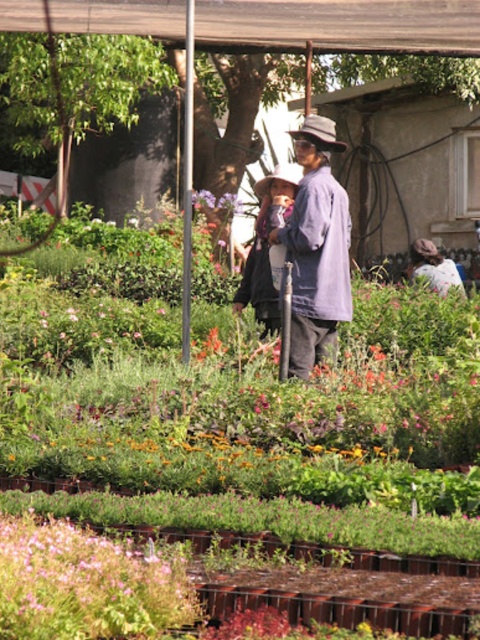
You are a gardener who needs to place a 3.5 feet wide decorative stone between the matte black jacket at center and the matte gray fedora at center. Is there enough space for the stone?

The distance between the matte black jacket at center and the matte gray fedora at center is 5.19 feet. Since the stone is 3.5 feet wide, there is enough space to place it between them as the distance is greater than the stone width.

You are standing at point (266, 177) and want to walk to point (119, 20). Is there a clear path between these two points?

Point (119, 20) is behind point (266, 177), so there is a clear path between them as there are no obstacles mentioned in the scene description.

You are a customer at the nursery looking for a specific plant. You see the wooden slats at upper center and the matte gray fedora at center. Which object is closer to you?

The wooden slats at upper center are closer to you because the matte gray fedora at center is behind them.